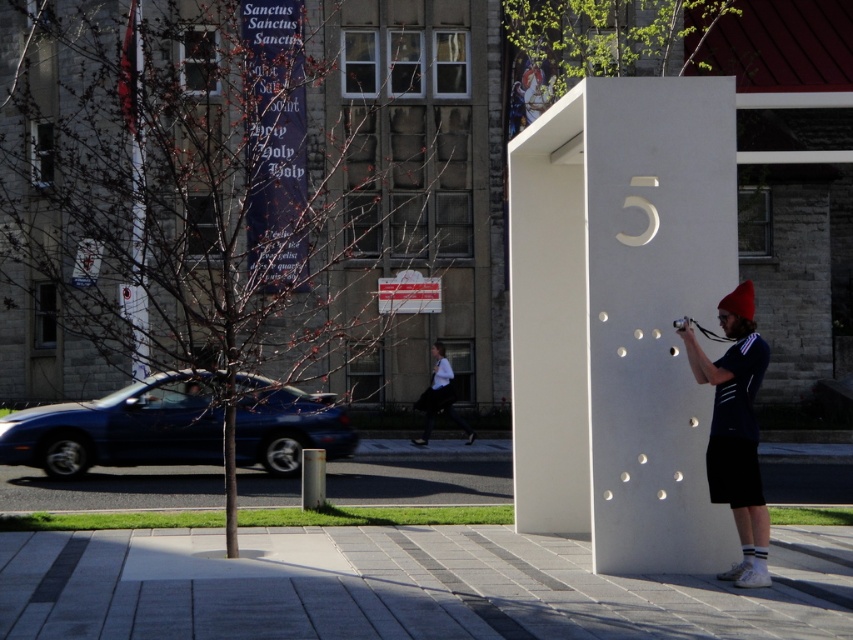
From the picture: You are a photographer trying to capture the person in the image. The person is wearing a matte black shirt at center and a white shirt at center. Which shirt should you focus on to ensure better visibility against the white structure with circular cutouts?

The white shirt at center should be focused on because it contrasts more with the white structure, making it more visible. However, the matte black shirt at center occupies less space, so it might be harder to spot.

You are a photographer aiming to capture the white smooth pillar at center and the white shirt at center in your shot. Based on their positions, which object will appear larger in the photo?

The white smooth pillar at center will appear larger in the photo because it is closer to the viewer than the white shirt at center.